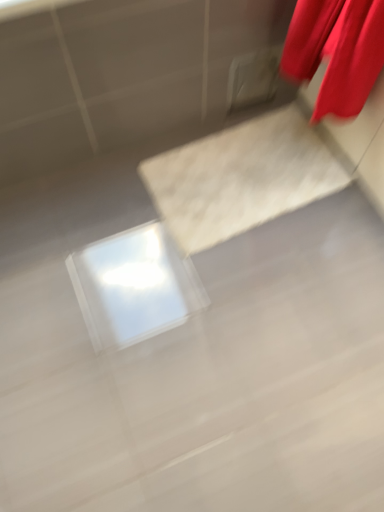
Question: Considering the positions of red satin curtain at upper right and white glossy concrete at center in the image, is red satin curtain at upper right wider or thinner than white glossy concrete at center?

Choices:
 (A) thin
 (B) wide

Answer: (A)

Question: From a real-world perspective, is red satin curtain at upper right physically located above or below white glossy concrete at center?

Choices:
 (A) below
 (B) above

Answer: (B)

Question: In terms of size, does red satin curtain at upper right appear bigger or smaller than white glossy concrete at center?

Choices:
 (A) small
 (B) big

Answer: (A)

Question: From their relative heights in the image, would you say white glossy concrete at center is taller or shorter than red satin curtain at upper right?

Choices:
 (A) short
 (B) tall

Answer: (A)

Question: Looking at their shapes, would you say white glossy concrete at center is wider or thinner than red satin curtain at upper right?

Choices:
 (A) thin
 (B) wide

Answer: (B)

Question: Based on their positions, is white glossy concrete at center located to the left or right of red satin curtain at upper right?

Choices:
 (A) left
 (B) right

Answer: (A)

Question: Is point (205, 364) positioned closer to the camera than point (291, 24)?

Choices:
 (A) closer
 (B) farther

Answer: (A)